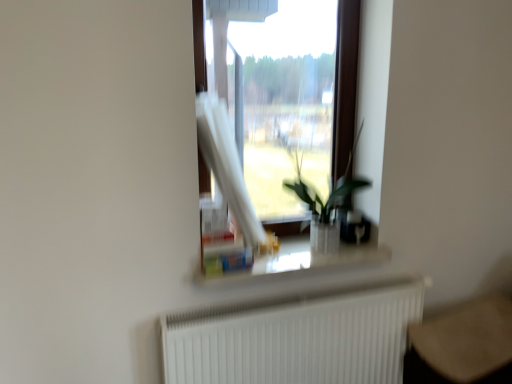
Question: Does green leafy plant at center have a greater width compared to white matte radiator at lower center?

Choices:
 (A) no
 (B) yes

Answer: (B)

Question: Does green leafy plant at center have a greater height compared to white matte radiator at lower center?

Choices:
 (A) yes
 (B) no

Answer: (A)

Question: From the image's perspective, is green leafy plant at center over white matte radiator at lower center?

Choices:
 (A) yes
 (B) no

Answer: (A)

Question: Considering the relative positions of green leafy plant at center and white matte radiator at lower center in the image provided, is green leafy plant at center to the left of white matte radiator at lower center from the viewer's perspective?

Choices:
 (A) yes
 (B) no

Answer: (B)

Question: Is the depth of green leafy plant at center greater than that of white matte radiator at lower center?

Choices:
 (A) yes
 (B) no

Answer: (A)

Question: In terms of width, does white matte radiator at lower center look wider or thinner when compared to green leafy plant at center?

Choices:
 (A) thin
 (B) wide

Answer: (A)

Question: From their relative heights in the image, would you say white matte radiator at lower center is taller or shorter than green leafy plant at center?

Choices:
 (A) short
 (B) tall

Answer: (A)

Question: From a real-world perspective, is white matte radiator at lower center positioned above or below green leafy plant at center?

Choices:
 (A) above
 (B) below

Answer: (B)

Question: Is white matte radiator at lower center to the left or to the right of green leafy plant at center in the image?

Choices:
 (A) right
 (B) left

Answer: (B)

Question: From a real-world perspective, is green leafy plant at center physically located above or below white matte radiator at lower center?

Choices:
 (A) above
 (B) below

Answer: (A)

Question: Considering the positions of point (342, 183) and point (424, 278), is point (342, 183) closer or farther from the camera than point (424, 278)?

Choices:
 (A) closer
 (B) farther

Answer: (A)

Question: Is green leafy plant at center inside the boundaries of white matte radiator at lower center, or outside?

Choices:
 (A) inside
 (B) outside

Answer: (B)

Question: Is green leafy plant at center wider or thinner than white matte radiator at lower center?

Choices:
 (A) wide
 (B) thin

Answer: (A)

Question: Considering the positions of white matte radiator at lower center and transparent glass window at center in the image, is white matte radiator at lower center bigger or smaller than transparent glass window at center?

Choices:
 (A) small
 (B) big

Answer: (B)

Question: Is point (165, 370) positioned closer to the camera than point (215, 221)?

Choices:
 (A) farther
 (B) closer

Answer: (B)